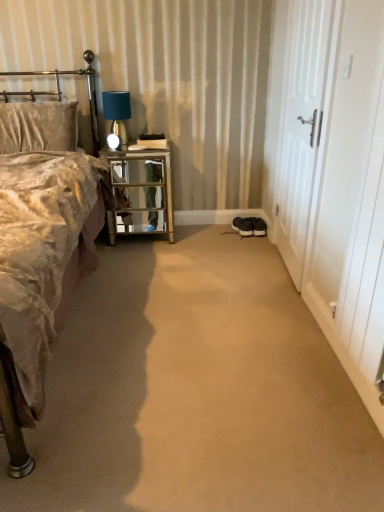
This screenshot has height=512, width=384. Find the location of `vacant area that is in front of black suede sneakers at lower center`. vacant area that is in front of black suede sneakers at lower center is located at coordinates (243, 240).